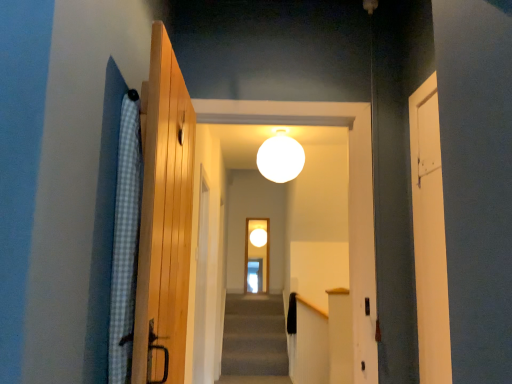
Question: Is blue checkered fabric at left aimed at white matte door at right, acting as the 2th door starting from the front?

Choices:
 (A) yes
 (B) no

Answer: (A)

Question: Is blue checkered fabric at left thinner than white matte door at right, acting as the 2th door starting from the front?

Choices:
 (A) yes
 (B) no

Answer: (B)

Question: Is blue checkered fabric at left shorter than white matte door at right, the 2th door from the back?

Choices:
 (A) yes
 (B) no

Answer: (A)

Question: From the image's perspective, is blue checkered fabric at left below white matte door at right, marked as the first door in a right-to-left arrangement?

Choices:
 (A) yes
 (B) no

Answer: (B)

Question: Considering the relative sizes of blue checkered fabric at left and white matte door at right, marked as the first door in a right-to-left arrangement, in the image provided, is blue checkered fabric at left bigger than white matte door at right, marked as the first door in a right-to-left arrangement,?

Choices:
 (A) yes
 (B) no

Answer: (A)

Question: Would you say translucent glass screen door at center is inside or outside white matte door at right, acting as the 2th door starting from the front?

Choices:
 (A) outside
 (B) inside

Answer: (A)

Question: From their relative heights in the image, would you say translucent glass screen door at center is taller or shorter than white matte door at right, the 2th door from the back?

Choices:
 (A) tall
 (B) short

Answer: (A)

Question: From a real-world perspective, is translucent glass screen door at center physically located above or below white matte door at right, the 3th door in the left-to-right sequence?

Choices:
 (A) above
 (B) below

Answer: (B)

Question: Is point (245, 241) closer or farther from the camera than point (431, 240)?

Choices:
 (A) farther
 (B) closer

Answer: (A)

Question: In the image, is white matte sphere at center on the left side or the right side of translucent glass screen door at center?

Choices:
 (A) left
 (B) right

Answer: (B)

Question: Is white matte sphere at center inside the boundaries of translucent glass screen door at center, or outside?

Choices:
 (A) outside
 (B) inside

Answer: (A)

Question: From the image's perspective, is white matte sphere at center located above or below translucent glass screen door at center?

Choices:
 (A) above
 (B) below

Answer: (A)

Question: From their relative heights in the image, would you say white matte sphere at center is taller or shorter than translucent glass screen door at center?

Choices:
 (A) short
 (B) tall

Answer: (A)

Question: In the image, is wooden door at center, which ranks as the 1th door in back-to-front order, positioned in front of or behind white matte sphere at center?

Choices:
 (A) behind
 (B) front

Answer: (B)

Question: Is point (205, 213) closer or farther from the camera than point (292, 155)?

Choices:
 (A) farther
 (B) closer

Answer: (A)